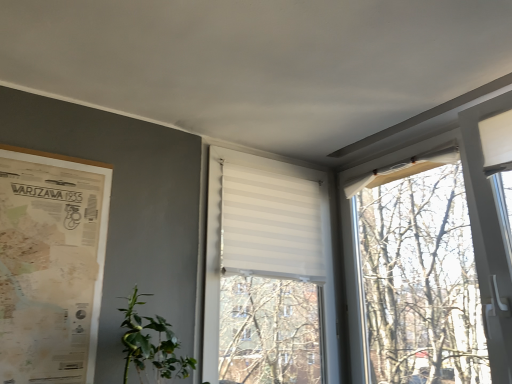
This screenshot has width=512, height=384. Identify the location of white striped blind at center. (x=268, y=273).

This screenshot has height=384, width=512. Describe the element at coordinates (268, 273) in the screenshot. I see `white striped blind at center` at that location.

The height and width of the screenshot is (384, 512). In order to click on vintage paper map at left in this screenshot , I will do `click(50, 265)`.

Considering the positions of objects green leafy plant at lower left and vintage paper map at left in the image provided, who is more to the left, green leafy plant at lower left or vintage paper map at left?

Positioned to the left is vintage paper map at left.

Does green leafy plant at lower left have a lesser width compared to vintage paper map at left?

Incorrect, the width of green leafy plant at lower left is not less than that of vintage paper map at left.

Is vintage paper map at left at the back of green leafy plant at lower left?

No.

From a real-world perspective, is vintage paper map at left above or below green leafy plant at lower left?

vintage paper map at left is above green leafy plant at lower left.

Which object is positioned more to the left, vintage paper map at left or green leafy plant at lower left?

vintage paper map at left.

In the scene shown: Is white striped blind at center spatially inside vintage paper map at left, or outside of it?

white striped blind at center is not enclosed by vintage paper map at left.

What's the angular difference between white striped blind at center and vintage paper map at left's facing directions?

The facing directions of white striped blind at center and vintage paper map at left are 0.278 degrees apart.

From the image's perspective, is white striped blind at center below vintage paper map at left?

Correct, white striped blind at center appears lower than vintage paper map at left in the image.

Which is behind, white striped blind at center or vintage paper map at left?

white striped blind at center.

Considering the sizes of objects vintage paper map at left and white striped blind at center in the image provided, who is thinner, vintage paper map at left or white striped blind at center?

vintage paper map at left.

Is vintage paper map at left located outside white striped blind at center?

Absolutely, vintage paper map at left is external to white striped blind at center.

In the scene shown: Is vintage paper map at left facing away from white striped blind at center?

vintage paper map at left is not turned away from white striped blind at center.

Is green leafy plant at lower left bigger than white striped blind at center?

No, green leafy plant at lower left is not bigger than white striped blind at center.

Is green leafy plant at lower left spatially inside white striped blind at center, or outside of it?

green leafy plant at lower left is not inside white striped blind at center, it's outside.

From the image's perspective, is green leafy plant at lower left under white striped blind at center?

Indeed, from the image's perspective, green leafy plant at lower left is shown beneath white striped blind at center.

Where is `window lying on the right of green leafy plant at lower left`? window lying on the right of green leafy plant at lower left is located at coordinates (268, 273).

Is white striped blind at center behind green leafy plant at lower left?

Yes.

Considering the relative positions of white striped blind at center and green leafy plant at lower left in the image provided, is white striped blind at center to the left of green leafy plant at lower left from the viewer's perspective?

No.

In terms of height, does white striped blind at center look taller or shorter compared to green leafy plant at lower left?

Clearly, white striped blind at center is taller compared to green leafy plant at lower left.

Which is farther, (276, 300) or (126, 318)?

Positioned behind is point (276, 300).

Locate an element on the screen. This screenshot has width=512, height=384. houseplant below the vintage paper map at left (from the image's perspective) is located at coordinates point(151,344).

In order to click on poster page lying on the left of green leafy plant at lower left in this screenshot , I will do `click(50, 265)`.

Estimate the real-world distances between objects in this image. Which object is further from white striped blind at center, green leafy plant at lower left or vintage paper map at left?

vintage paper map at left is further to white striped blind at center.

Which object lies nearer to the anchor point green leafy plant at lower left, vintage paper map at left or white striped blind at center?

Among the two, vintage paper map at left is located nearer to green leafy plant at lower left.

Estimate the real-world distances between objects in this image. Which object is further from vintage paper map at left, green leafy plant at lower left or white striped blind at center?

Based on the image, white striped blind at center appears to be further to vintage paper map at left.

Based on their spatial positions, is vintage paper map at left or green leafy plant at lower left further from white striped blind at center?

vintage paper map at left.

Which object lies nearer to the anchor point vintage paper map at left, white striped blind at center or green leafy plant at lower left?

Among the two, green leafy plant at lower left is located nearer to vintage paper map at left.

Consider the image. Estimate the real-world distances between objects in this image. Which object is closer to green leafy plant at lower left, white striped blind at center or vintage paper map at left?

vintage paper map at left is closer to green leafy plant at lower left.

The image size is (512, 384). Find the location of `houseplant situated between vintage paper map at left and white striped blind at center from left to right`. houseplant situated between vintage paper map at left and white striped blind at center from left to right is located at coordinates (151, 344).